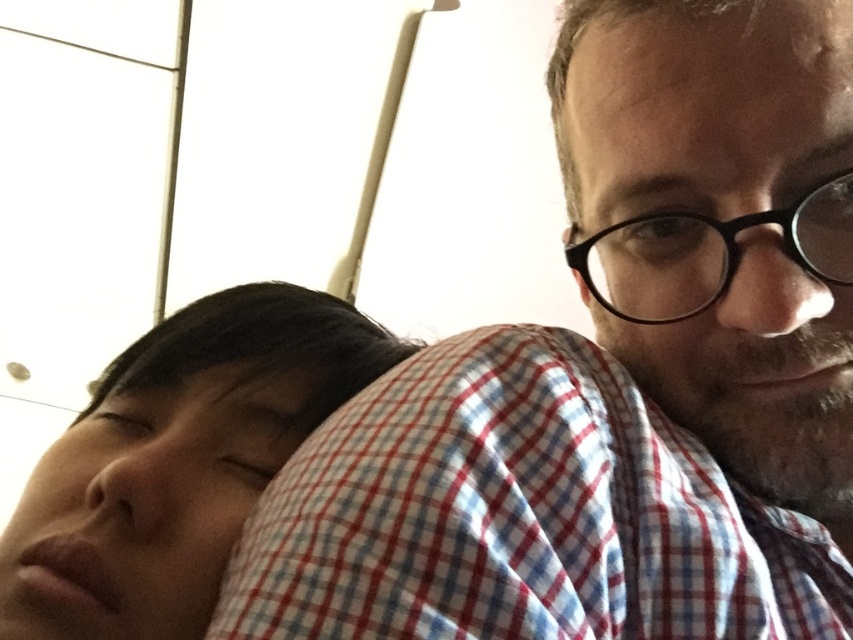
You are arranging a cozy reading corner and have placed a red checkered fabric pillow at upper center and a matte checkered shirt at right. If you want to place a book between them, where should you position it?

The book should be placed between the red checkered fabric pillow at upper center and the matte checkered shirt at right since the pillow is to the left of the shirt.

You are an interior designer working on a layout for a cozy living room. You have a red checkered fabric pillow at upper center that needs to be placed on a sofa. The sofa has a seating area that extends from coordinates 0.7 to 0.9 along the x and y axes. Will the pillow fit within the sofa seating area?

The red checkered fabric pillow at upper center is located at point (521, 515). Since the sofa seating area spans from 0.7 to 0.9 on both axes, the pillow is within those coordinates and will fit on the sofa seating area.

You are standing in the scene and want to move from the point at coordinates point (434,476) to the point at coordinates point (701,204). Which direction should you face to walk towards the second point?

To move from point (434,476) to point (701,204), you should face towards the upper left direction since point (701,204) is located above and to the left of point (434,476).